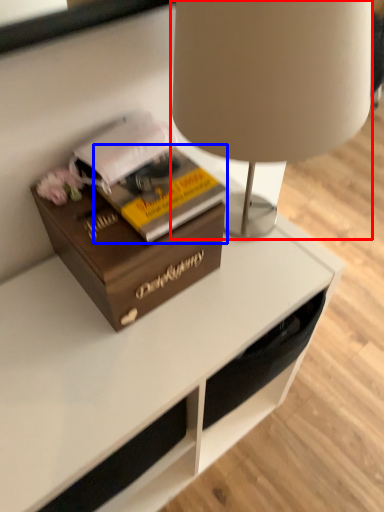
Question: Which object appears farthest to the camera in this image, lamp (highlighted by a red box) or paperback book (highlighted by a blue box)?

Choices:
 (A) lamp
 (B) paperback book

Answer: (B)